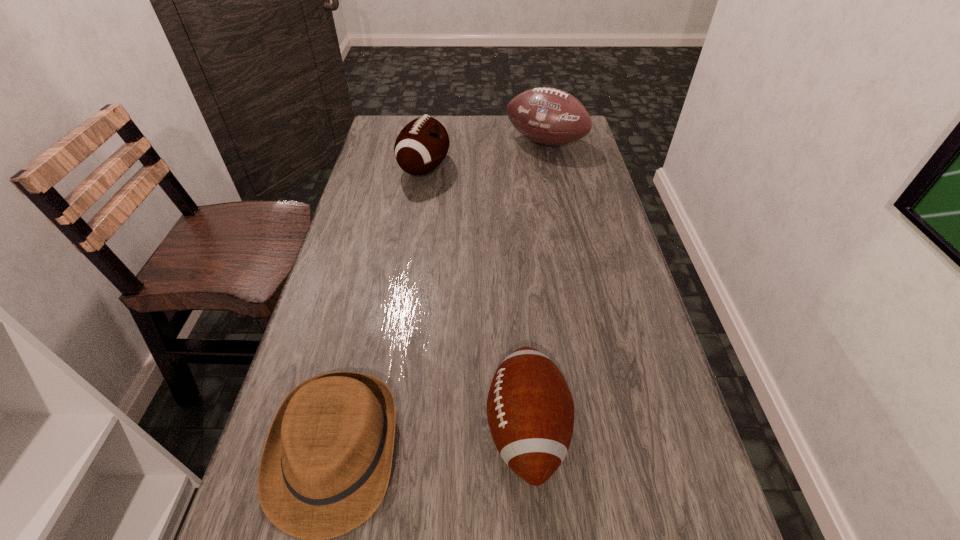
Locate an element on the screen. football that is the second closest to the leftmost football is located at coordinates (530, 410).